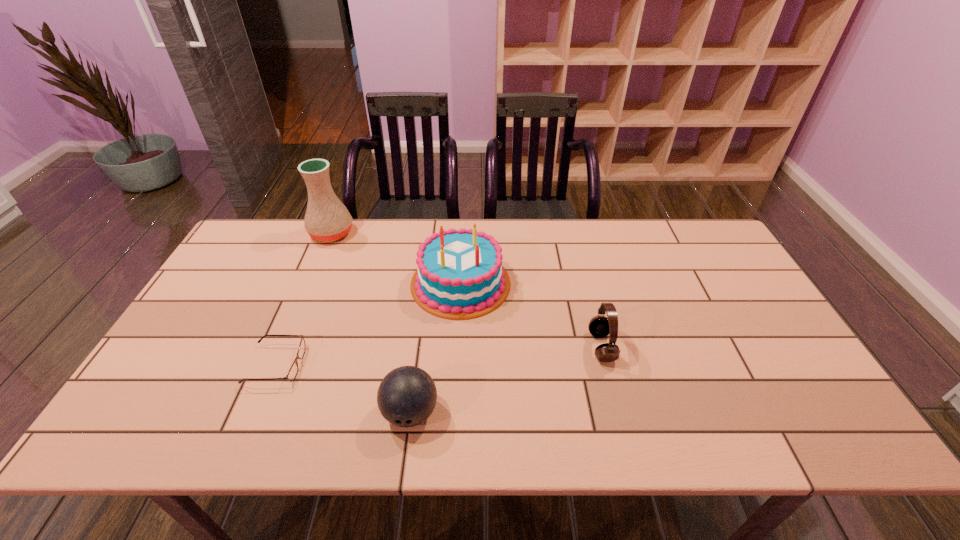
This screenshot has width=960, height=540. What are the coordinates of `blank area at the far right corner` in the screenshot? It's located at pyautogui.click(x=672, y=230).

This screenshot has height=540, width=960. Identify the location of free area in between the spectacles and the rightmost object. (439, 356).

The image size is (960, 540). I want to click on unoccupied position between the rightmost object and the birthday cake, so click(x=531, y=315).

Find the location of `free space between the fourth nearest object and the tallest object`. free space between the fourth nearest object and the tallest object is located at coordinates (396, 258).

Image resolution: width=960 pixels, height=540 pixels. What are the coordinates of `vacant point located between the spectacles and the bowling ball` in the screenshot? It's located at (343, 389).

The image size is (960, 540). Find the location of `vacant point located between the bowling ball and the fourth shortest object`. vacant point located between the bowling ball and the fourth shortest object is located at coordinates (436, 348).

I want to click on free space between the rightmost object and the spectacles, so click(439, 356).

You are a GUI agent. You are given a task and a screenshot of the screen. Output one action in this format:
    pyautogui.click(x=<x>, y=<y>)
    Task: Click on the free space between the farthest object and the birthday cake
    The width and height of the screenshot is (960, 540).
    Given the screenshot: What is the action you would take?
    pyautogui.click(x=396, y=258)

Locate an element on the screen. The image size is (960, 540). free area in between the rightmost object and the shortest object is located at coordinates (439, 356).

At what (x,y) coordinates should I click in order to perform the action: click on free spot between the second tallest object and the headset. Please return your answer as a coordinate pair (x, y). Image resolution: width=960 pixels, height=540 pixels. Looking at the image, I should click on (531, 315).